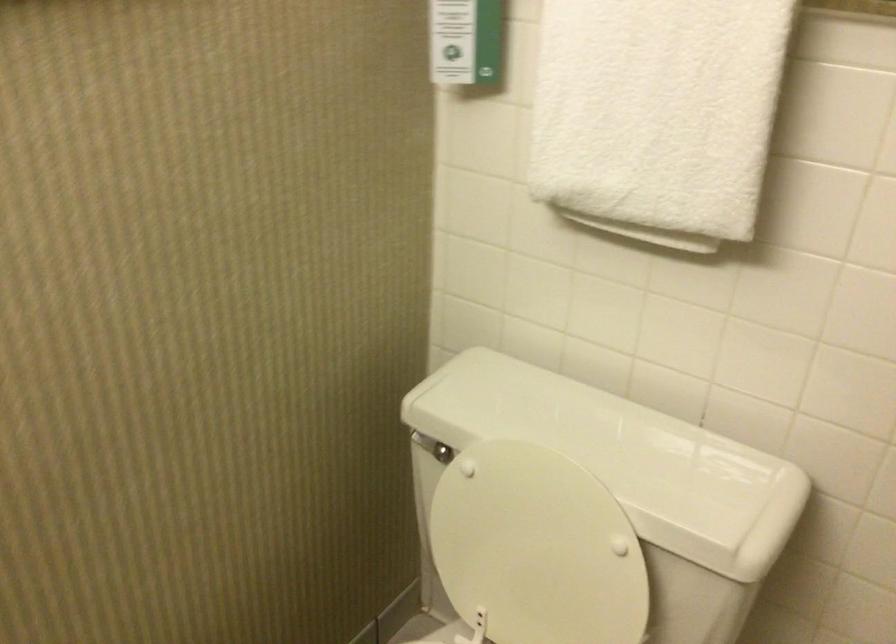
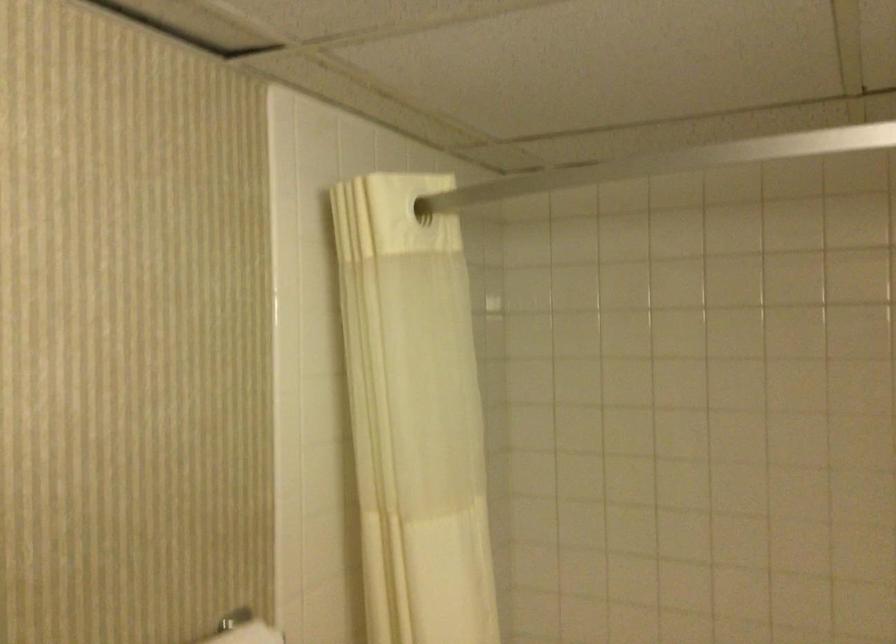
Question: The camera is either moving clockwise (left) or counter-clockwise (right) around the object. The first image is from the beginning of the video and the second image is from the end. Is the camera moving left or right when shooting the video?

Choices:
 (A) Left
 (B) Right

Answer: (A)